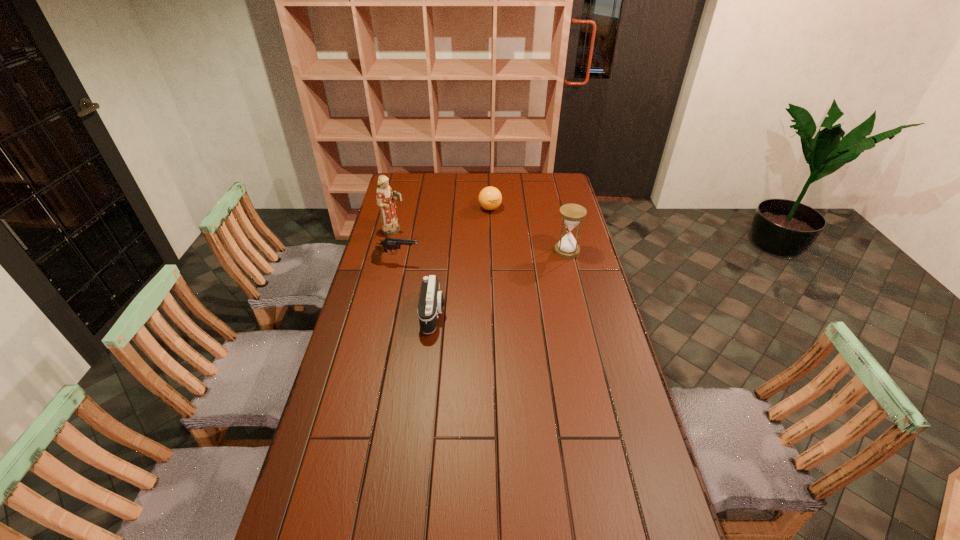
Where is `vacant space located 0.370m on the left of the rightmost object`? This screenshot has width=960, height=540. vacant space located 0.370m on the left of the rightmost object is located at coordinates (468, 251).

You are a GUI agent. You are given a task and a screenshot of the screen. Output one action in this format:
    pyautogui.click(x=<x>, y=<y>)
    Task: Click on the free space located 0.380m along the barrel of the gun
    The height and width of the screenshot is (540, 960).
    Given the screenshot: What is the action you would take?
    pyautogui.click(x=513, y=269)

Find the location of a particular element. This screenshot has width=960, height=540. free spot located along the barrel of the gun is located at coordinates (488, 268).

In order to click on free region located 0.070m along the barrel of the gun in this screenshot , I will do `click(437, 264)`.

This screenshot has width=960, height=540. Find the location of `vacant space located on the front-facing side of the figurine`. vacant space located on the front-facing side of the figurine is located at coordinates (481, 264).

The height and width of the screenshot is (540, 960). In order to click on vacant area located 0.300m on the front-facing side of the figurine in this screenshot , I will do `click(460, 256)`.

Image resolution: width=960 pixels, height=540 pixels. I want to click on free region located on the front-facing side of the figurine, so click(x=454, y=254).

I want to click on vacant space located on the side with brand of the second object from right to left, so click(491, 222).

I want to click on vacant space situated 0.100m on the side with brand of the second object from right to left, so 492,227.

The height and width of the screenshot is (540, 960). Identify the location of free space located 0.080m on the side with brand of the second object from right to left. (492, 224).